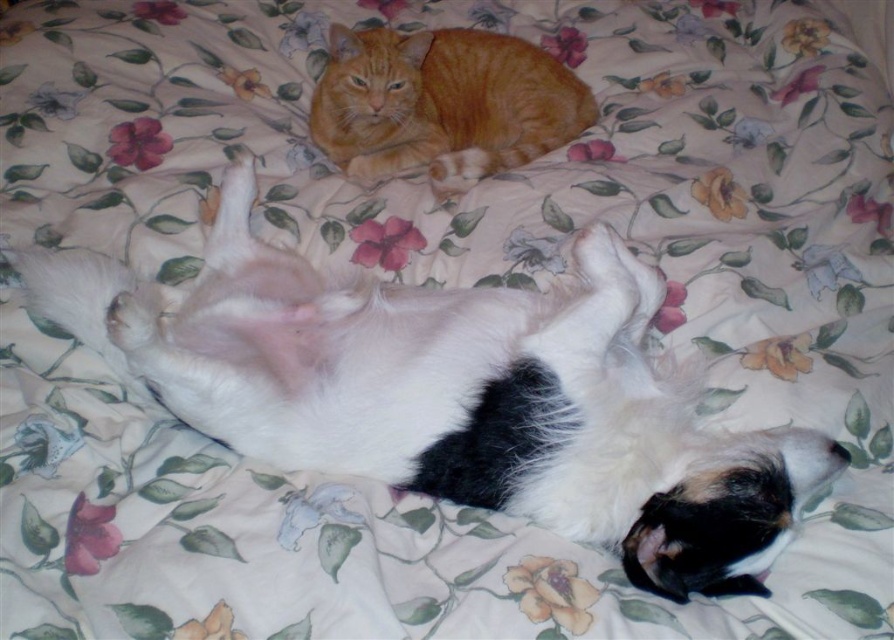
Question: Does white soft fur cat at upper center appear on the right side of orange fur cat at upper center?

Choices:
 (A) yes
 (B) no

Answer: (B)

Question: Which object is farther from the camera taking this photo?

Choices:
 (A) orange fur cat at upper center
 (B) white soft fur cat at upper center

Answer: (A)

Question: Which object appears closest to the camera in this image?

Choices:
 (A) orange fur cat at upper center
 (B) white soft fur cat at upper center

Answer: (B)

Question: Is white soft fur cat at upper center bigger than orange fur cat at upper center?

Choices:
 (A) no
 (B) yes

Answer: (B)

Question: Which point is closer to the camera?

Choices:
 (A) (483, 64)
 (B) (661, 500)

Answer: (B)

Question: Is white soft fur cat at upper center positioned in front of orange fur cat at upper center?

Choices:
 (A) yes
 (B) no

Answer: (A)